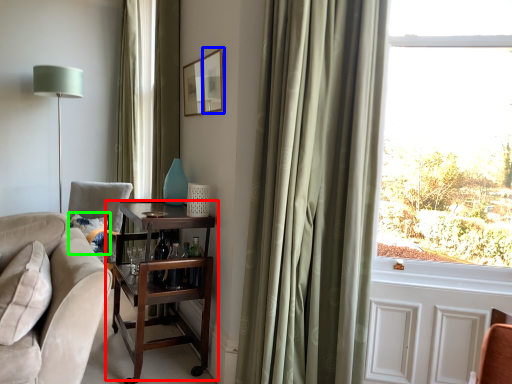
Question: Based on their relative distances, which object is farther from table (highlighted by a red box)? Choose from picture frame (highlighted by a blue box) and pillow (highlighted by a green box).

Choices:
 (A) picture frame
 (B) pillow

Answer: (A)